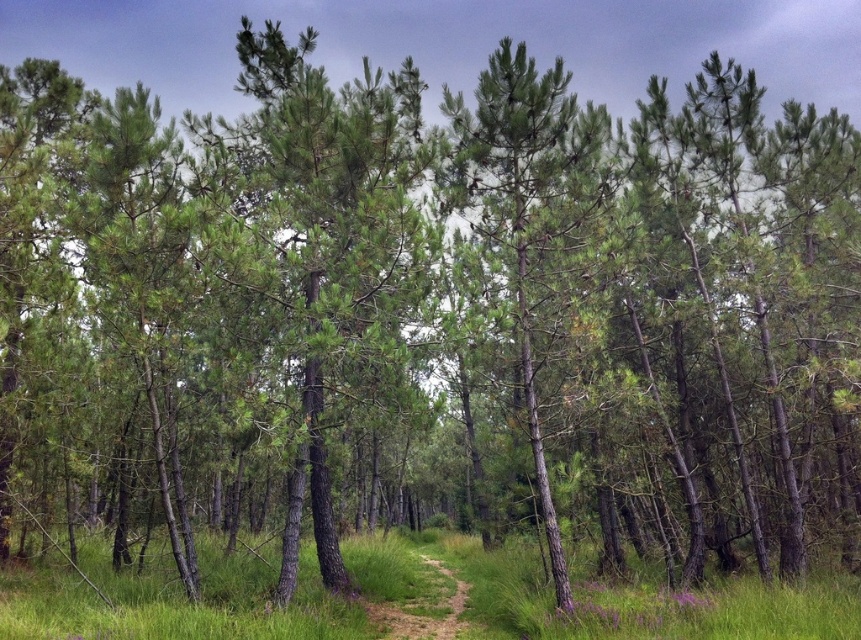
Question: Is green needle-like at center below green textured pine tree at center?

Choices:
 (A) no
 (B) yes

Answer: (A)

Question: Which object is farther from the camera taking this photo?

Choices:
 (A) green grass at center
 (B) green textured pine tree at center
 (C) green needle-like at center

Answer: (B)

Question: Which object is the farthest from the green needle-like at center?

Choices:
 (A) green textured pine tree at center
 (B) green grass at center

Answer: (B)

Question: Can you confirm if green grass at center is bigger than green textured pine tree at center?

Choices:
 (A) yes
 (B) no

Answer: (A)

Question: Which of the following is the closest to the observer?

Choices:
 (A) (369, 508)
 (B) (521, 253)
 (C) (616, 628)

Answer: (C)

Question: From the image, what is the correct spatial relationship of green needle-like at center in relation to green grass at center?

Choices:
 (A) left
 (B) right

Answer: (A)